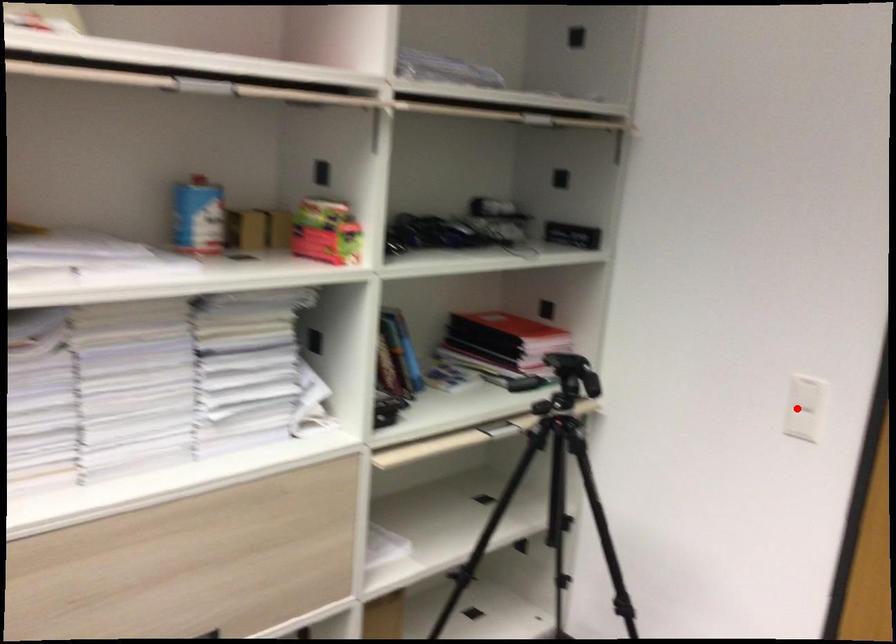
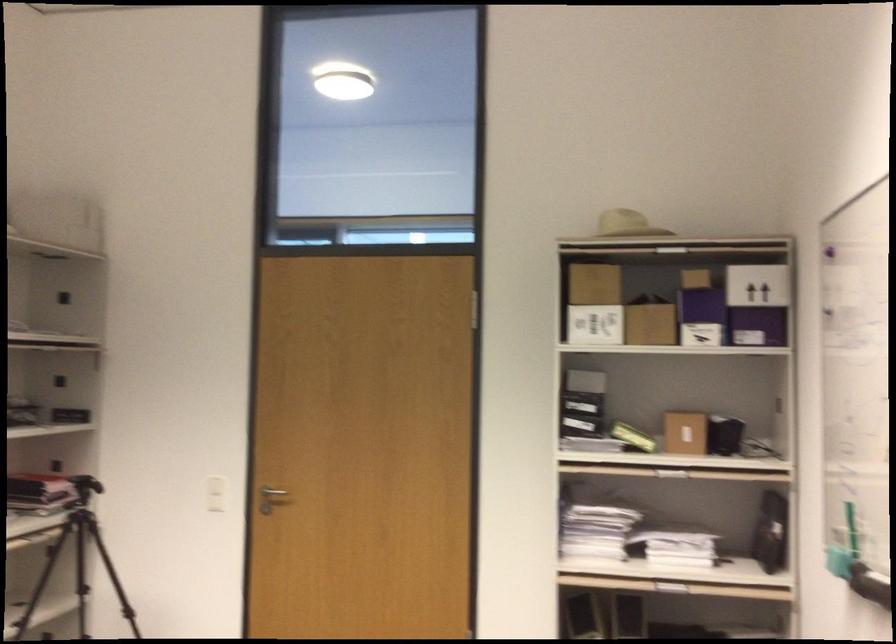
Locate, in the second image, the point that corresponds to the highlighted location in the first image.

(216, 494)